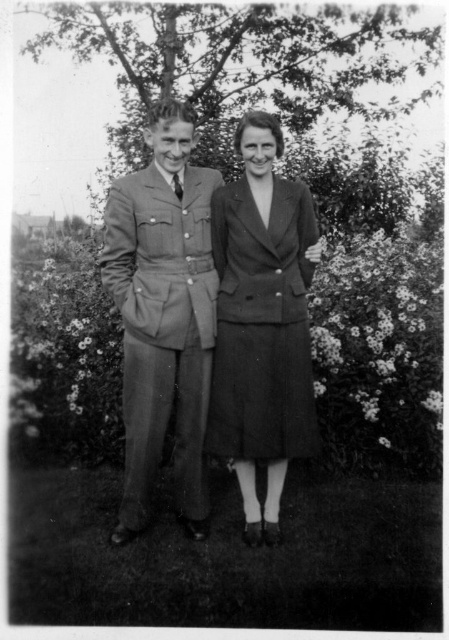
Question: Estimate the real-world distances between objects in this image. Which object is closer to the gray woolen suit at center?

Choices:
 (A) textured wool dress at center
 (B) matte gray suit at center

Answer: (B)

Question: Does matte gray suit at center have a lesser width compared to textured wool dress at center?

Choices:
 (A) yes
 (B) no

Answer: (B)

Question: Is matte gray suit at center smaller than gray woolen suit at center?

Choices:
 (A) no
 (B) yes

Answer: (A)

Question: Is matte gray suit at center to the right of textured wool dress at center from the viewer's perspective?

Choices:
 (A) yes
 (B) no

Answer: (B)

Question: Among these points, which one is nearest to the camera?

Choices:
 (A) (145, 387)
 (B) (119, 225)

Answer: (A)

Question: Which point is closer to the camera taking this photo?

Choices:
 (A) (149, 484)
 (B) (272, 342)
 (C) (259, 536)

Answer: (B)